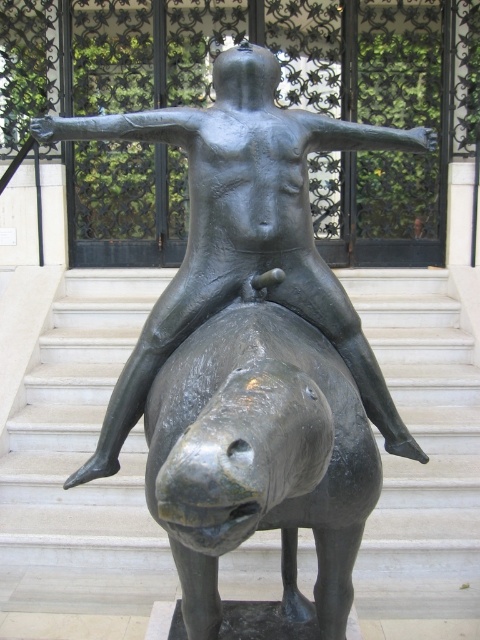
Looking at this image, you are an art curator planning to move the smooth gray horse at center and the bronze statue at center to a new gallery. The gallery has a 2 meter wide entrance. Which object should be moved first to ensure both can fit through the entrance without being damaged?

The bronze statue at center should be moved first since it is smaller in size than the smooth gray horse at center, allowing it to pass through the entrance more easily before the larger horse.

You are standing in front of the sculpture and want to touch both the smooth gray horse at center and the bronze statue at center. Which one can you reach first without moving your position?

The smooth gray horse at center is closer to you than the bronze statue at center, so you can reach it first without moving your position.

You are an art student observing the sculpture of a human figure on a donkey. You notice two objects labeled as the smooth gray horse at center and the bronze statue at center. Which object is taller?

The smooth gray horse at center is much taller than the bronze statue at center according to the description.